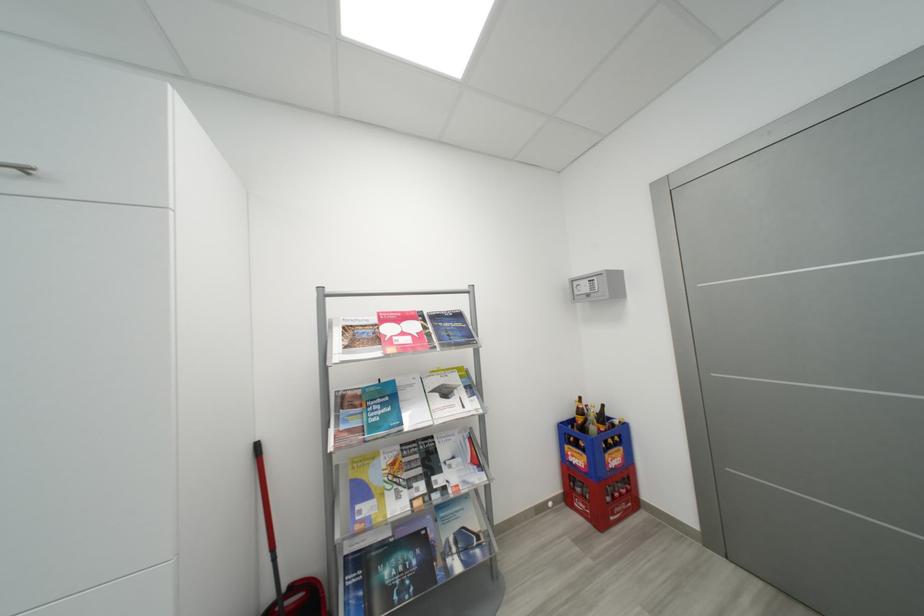
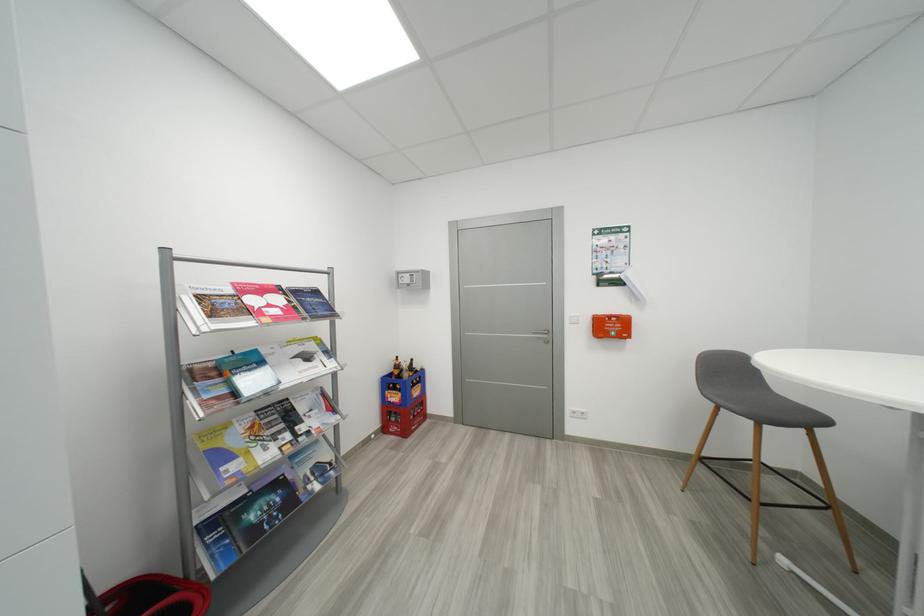
Question: The first image is from the beginning of the video and the second image is from the end. How did the camera likely rotate when shooting the video?

Choices:
 (A) Left
 (B) Right
 (C) Up
 (D) Down

Answer: (B)